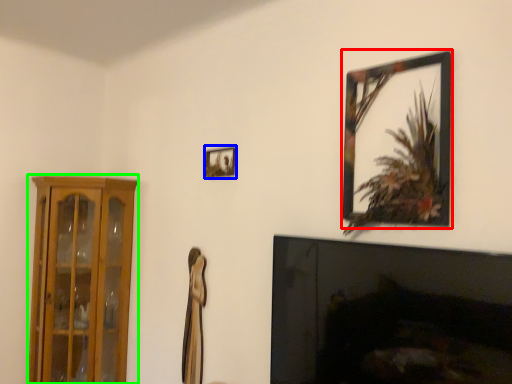
Question: Which is farther away from picture frame (highlighted by a red box)? picture frame (highlighted by a blue box) or cabinetry (highlighted by a green box)?

Choices:
 (A) picture frame
 (B) cabinetry

Answer: (B)